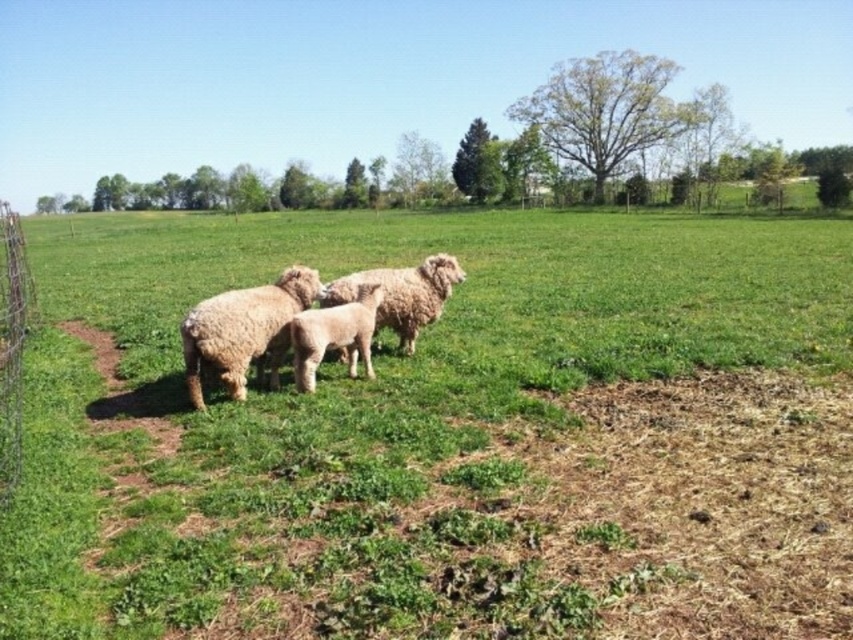
Question: From the image, what is the correct spatial relationship of fuzzy beige sheep at center in relation to fuzzy woolen sheep at center?

Choices:
 (A) left
 (B) right

Answer: (A)

Question: Which object is the closest to the green soft grass at center?

Choices:
 (A) fuzzy white sheep at center
 (B) wire mesh fence at left
 (C) fuzzy woolen sheep at center
 (D) fuzzy beige sheep at center

Answer: (C)

Question: Based on their relative distances, which object is nearer to the wire mesh fence at left?

Choices:
 (A) fuzzy white sheep at center
 (B) fuzzy beige sheep at center
 (C) fuzzy woolen sheep at center
 (D) green soft grass at center

Answer: (C)

Question: Is green soft grass at center further to camera compared to fuzzy white sheep at center?

Choices:
 (A) yes
 (B) no

Answer: (B)

Question: Which of the following is the farthest from the observer?

Choices:
 (A) fuzzy white sheep at center
 (B) fuzzy beige sheep at center
 (C) fuzzy woolen sheep at center
 (D) wire mesh fence at left

Answer: (A)

Question: Does green soft grass at center come behind fuzzy white sheep at center?

Choices:
 (A) no
 (B) yes

Answer: (A)